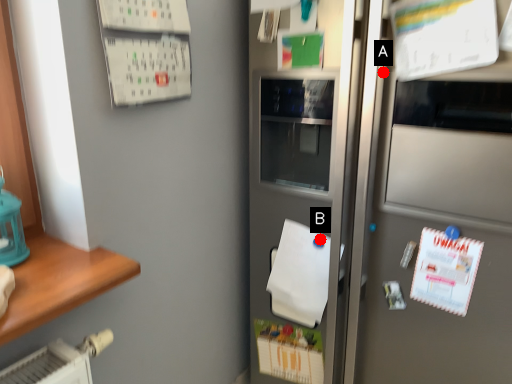
Question: Two points are circled on the image, labeled by A and B beside each circle. Which point is farther from the camera taking this photo?

Choices:
 (A) A is further
 (B) B is further

Answer: (B)